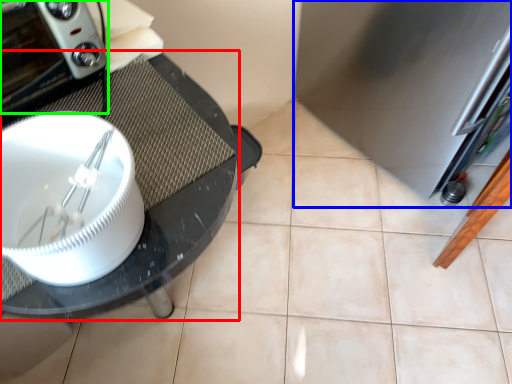
Question: Which object is the farthest from glass table (highlighted by a red box)? Choose among these: appliance (highlighted by a blue box) or home appliance (highlighted by a green box).

Choices:
 (A) appliance
 (B) home appliance

Answer: (A)